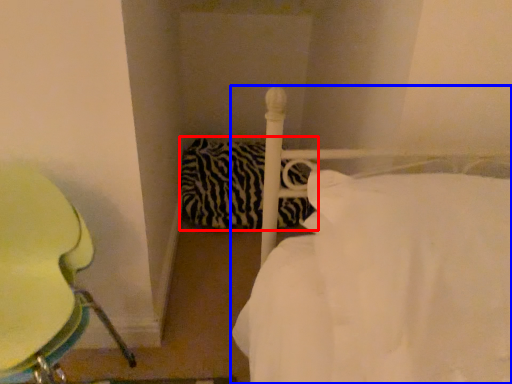
Question: Which object appears closest to the camera in this image, pillow (highlighted by a red box) or bed (highlighted by a blue box)?

Choices:
 (A) pillow
 (B) bed

Answer: (B)